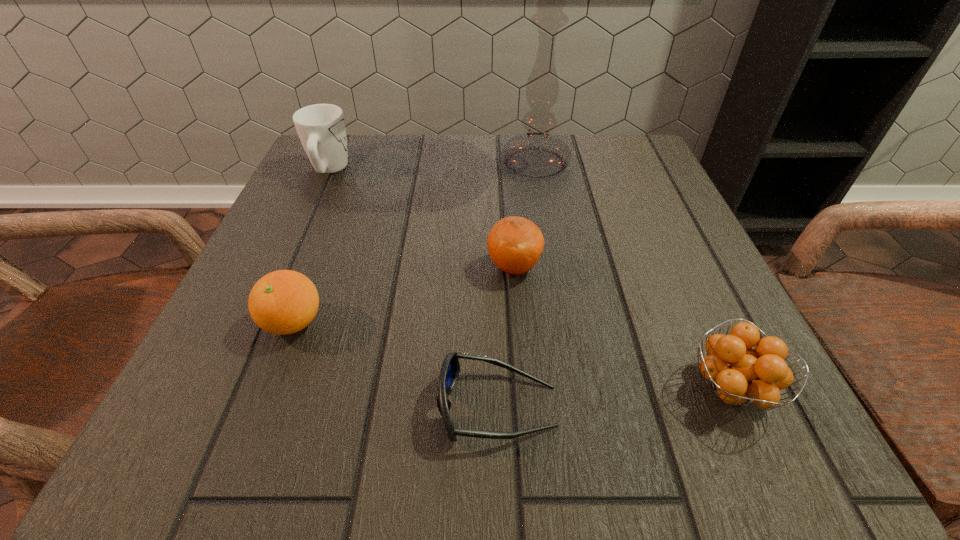
Locate an element on the screen. Image resolution: width=960 pixels, height=540 pixels. vacant region located 0.060m on the side of the mug with the handle is located at coordinates (342, 140).

Where is `vacant space located on the side of the mug with the handle`? vacant space located on the side of the mug with the handle is located at coordinates (341, 143).

You are a GUI agent. You are given a task and a screenshot of the screen. Output one action in this format:
    pyautogui.click(x=<x>, y=<y>)
    Task: Click on the vacant space located 0.060m on the side of the mug with the handle
    
    Given the screenshot: What is the action you would take?
    pyautogui.click(x=342, y=140)

At what (x,y) coordinates should I click in order to perform the action: click on blank space located 0.180m on the front of the second orange fruit from left to right. Please return your answer as a coordinate pair (x, y). The height and width of the screenshot is (540, 960). Looking at the image, I should click on (523, 386).

Identify the location of vacant space situated 0.300m on the right of the third nearest object. click(531, 322).

This screenshot has height=540, width=960. Identify the location of vacant region located 0.200m on the back of the rightmost object. (669, 253).

The image size is (960, 540). Identify the location of blank area located on the front-facing side of the sunglasses. (188, 406).

At what (x,y) coordinates should I click in order to perform the action: click on free location located 0.110m on the front-facing side of the sunglasses. Please return your answer as a coordinate pair (x, y). The width and height of the screenshot is (960, 540). Looking at the image, I should click on (350, 406).

This screenshot has width=960, height=540. I want to click on vacant space positioned 0.320m on the front-facing side of the sunglasses, so click(x=180, y=406).

Where is `table lamp present at the far edge`? Image resolution: width=960 pixels, height=540 pixels. table lamp present at the far edge is located at coordinates (537, 154).